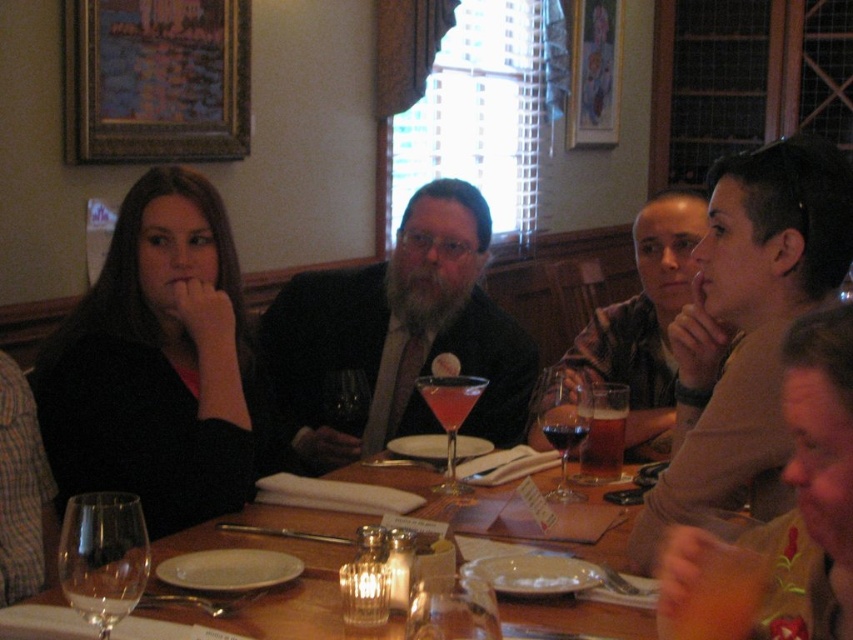
Question: Which of the following is the farthest from the observer?

Choices:
 (A) (379, 445)
 (B) (448, 376)

Answer: (A)

Question: Which point is closer to the camera?

Choices:
 (A) clear glass wine at table center
 (B) transparent glass at table left
 (C) translucent glass martini glass at center

Answer: (B)

Question: Is wooden table at center positioned in front of clear glass wine at table center?

Choices:
 (A) yes
 (B) no

Answer: (B)

Question: Does translucent amber liquid at center have a greater width compared to clear glass wine at table center?

Choices:
 (A) no
 (B) yes

Answer: (B)

Question: Does plaid shirt at center appear under translucent glass wine glass at center?

Choices:
 (A) no
 (B) yes

Answer: (A)

Question: Which of these objects is positioned closest to the plaid shirt at center?

Choices:
 (A) translucent glass martini glass at center
 (B) translucent amber liquid at center
 (C) brown leather jacket at upper right
 (D) matte black shirt at left

Answer: (B)